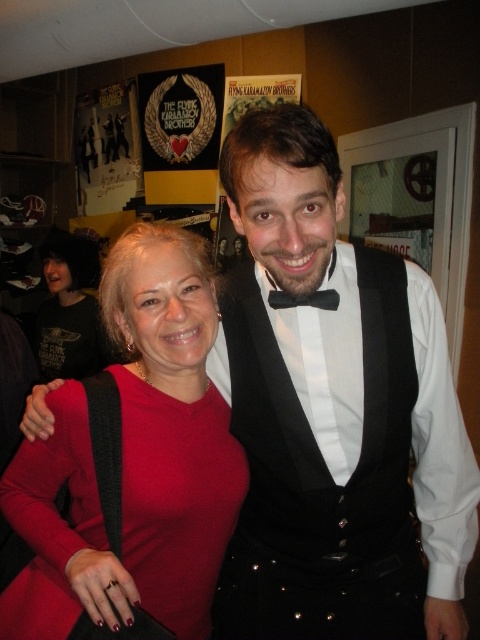
Can you confirm if matte red sweater at center is taller than black satin bow tie at center?

Correct, matte red sweater at center is much taller as black satin bow tie at center.

Can you confirm if matte red sweater at center is positioned to the left of black satin bow tie at center?

Indeed, matte red sweater at center is positioned on the left side of black satin bow tie at center.

Which is behind, point (148, 518) or point (331, 301)?

Positioned behind is point (148, 518).

The height and width of the screenshot is (640, 480). Identify the location of matte red sweater at center. (133, 460).